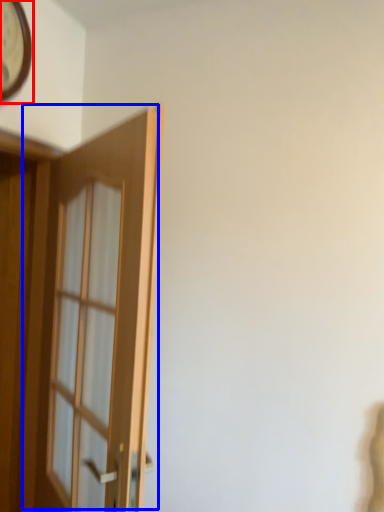
Question: Among these objects, which one is nearest to the camera, clock (highlighted by a red box) or door (highlighted by a blue box)?

Choices:
 (A) clock
 (B) door

Answer: (B)